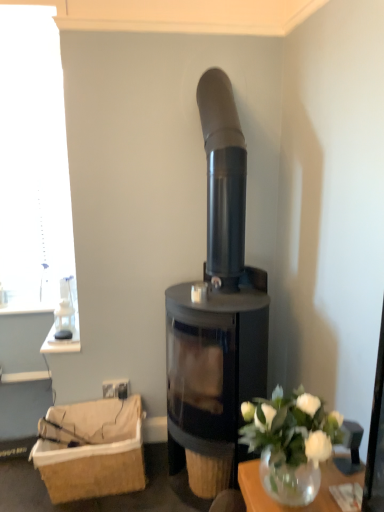
What do you see at coordinates (216, 314) in the screenshot?
I see `matte black wood burning stove at center` at bounding box center [216, 314].

Measure the distance between point (257, 405) and camera.

They are 4.10 feet apart.

The width and height of the screenshot is (384, 512). In order to click on matte black wood burning stove at center in this screenshot , I will do `click(216, 314)`.

Does point (92, 479) come behind point (254, 298)?

Yes.

Is brown woven basket at lower left behind matte black wood burning stove at center?

Yes, brown woven basket at lower left is behind matte black wood burning stove at center.

Is brown woven basket at lower left bigger than matte black wood burning stove at center?

No, brown woven basket at lower left is not bigger than matte black wood burning stove at center.

From a real-world perspective, which object stands above the other?

From a 3D spatial view, matte black wood burning stove at center is above.

The height and width of the screenshot is (512, 384). Find the location of `floral arrangement that appears below the matte black wood burning stove at center (from a real-world perspective)`. floral arrangement that appears below the matte black wood burning stove at center (from a real-world perspective) is located at coordinates (290, 442).

Could you tell me if matte black wood burning stove at center is turned towards white glass vase at lower right?

No.

How many degrees apart are the facing directions of matte black wood burning stove at center and white glass vase at lower right?

1.34 degrees separate the facing orientations of matte black wood burning stove at center and white glass vase at lower right.

Can you confirm if matte black wood burning stove at center is bigger than white glass vase at lower right?

Yes.

In the image, there is a white glass vase at lower right. Identify the location of basket below it (from a real-world perspective). (91, 449).

Considering the relative sizes of brown woven basket at lower left and white glass vase at lower right in the image provided, is brown woven basket at lower left shorter than white glass vase at lower right?

No, brown woven basket at lower left is not shorter than white glass vase at lower right.

Considering the points (78, 490) and (282, 404), which point is behind, point (78, 490) or point (282, 404)?

The point (78, 490) is behind.

From the image's perspective, between brown woven basket at lower left and white glass vase at lower right, which one is located above?

white glass vase at lower right, from the image's perspective.

Can you confirm if white glass vase at lower right is thinner than brown woven basket at lower left?

Indeed, white glass vase at lower right has a lesser width compared to brown woven basket at lower left.

From the image's perspective, is white glass vase at lower right above or below brown woven basket at lower left?

Based on their image positions, white glass vase at lower right is located above brown woven basket at lower left.

Identify the location of basket below the white glass vase at lower right (from a real-world perspective). The width and height of the screenshot is (384, 512). (91, 449).

Is white glass vase at lower right not near brown woven basket at lower left?

white glass vase at lower right is positioned a significant distance from brown woven basket at lower left.

Is matte black wood burning stove at center situated inside brown woven basket at lower left or outside?

matte black wood burning stove at center is not inside brown woven basket at lower left, it's outside.

From a real-world perspective, who is located higher, matte black wood burning stove at center or brown woven basket at lower left?

From a 3D spatial view, matte black wood burning stove at center is above.

What's the angular difference between matte black wood burning stove at center and brown woven basket at lower left's facing directions?

The facing directions of matte black wood burning stove at center and brown woven basket at lower left are 89.2 degrees apart.

Identify the location of wood burning stove that is above the brown woven basket at lower left (from a real-world perspective). (216, 314).

Does white glass vase at lower right appear on the left side of matte black wood burning stove at center?

Incorrect, white glass vase at lower right is not on the left side of matte black wood burning stove at center.

Is white glass vase at lower right directly adjacent to matte black wood burning stove at center?

No, white glass vase at lower right is not in contact with matte black wood burning stove at center.

Considering the sizes of objects white glass vase at lower right and matte black wood burning stove at center in the image provided, who is bigger, white glass vase at lower right or matte black wood burning stove at center?

Bigger between the two is matte black wood burning stove at center.

How many degrees apart are the facing directions of white glass vase at lower right and matte black wood burning stove at center?

white glass vase at lower right and matte black wood burning stove at center are facing 1.34 degrees away from each other.

This screenshot has width=384, height=512. Find the location of `basket that is below the matte black wood burning stove at center (from the image's perspective)`. basket that is below the matte black wood burning stove at center (from the image's perspective) is located at coordinates (91, 449).

Locate an element on the screen. This screenshot has width=384, height=512. floral arrangement on the right of the matte black wood burning stove at center is located at coordinates (290, 442).

Based on their spatial positions, is matte black wood burning stove at center or white glass vase at lower right closer to brown woven basket at lower left?

matte black wood burning stove at center is positioned closer to the anchor brown woven basket at lower left.

Looking at the image, which one is located closer to brown woven basket at lower left, white glass vase at lower right or matte black wood burning stove at center?

matte black wood burning stove at center is closer to brown woven basket at lower left.

When comparing their distances from white glass vase at lower right, does matte black wood burning stove at center or brown woven basket at lower left seem further?

brown woven basket at lower left is further to white glass vase at lower right.

From the image, which object appears to be nearer to white glass vase at lower right, brown woven basket at lower left or matte black wood burning stove at center?

Among the two, matte black wood burning stove at center is located nearer to white glass vase at lower right.

From the picture: From the image, which object appears to be nearer to matte black wood burning stove at center, brown woven basket at lower left or white glass vase at lower right?

brown woven basket at lower left lies closer to matte black wood burning stove at center than the other object.

Which object lies nearer to the anchor point matte black wood burning stove at center, white glass vase at lower right or brown woven basket at lower left?

Based on the image, brown woven basket at lower left appears to be nearer to matte black wood burning stove at center.

Locate an element on the screen. wood burning stove located between white glass vase at lower right and brown woven basket at lower left in the depth direction is located at coordinates pyautogui.click(x=216, y=314).